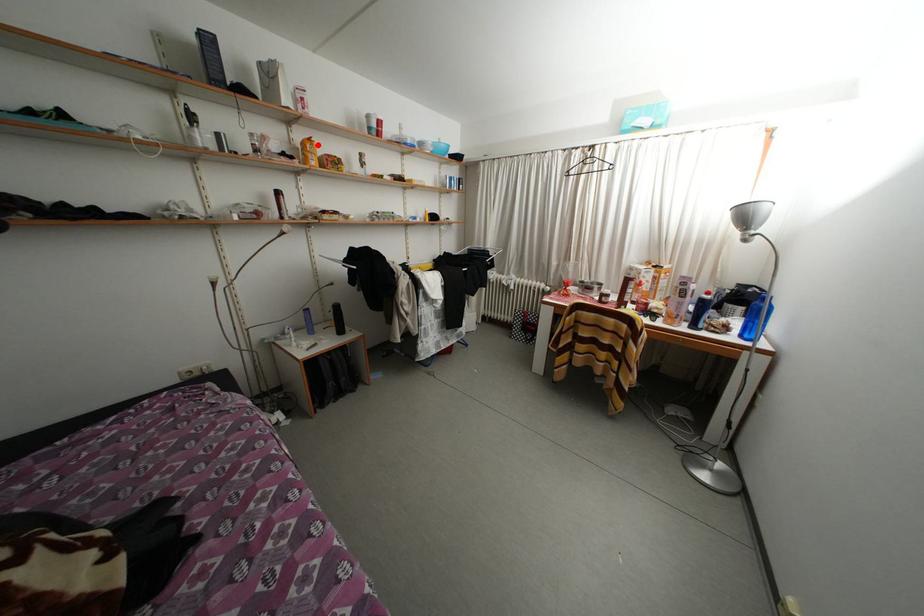
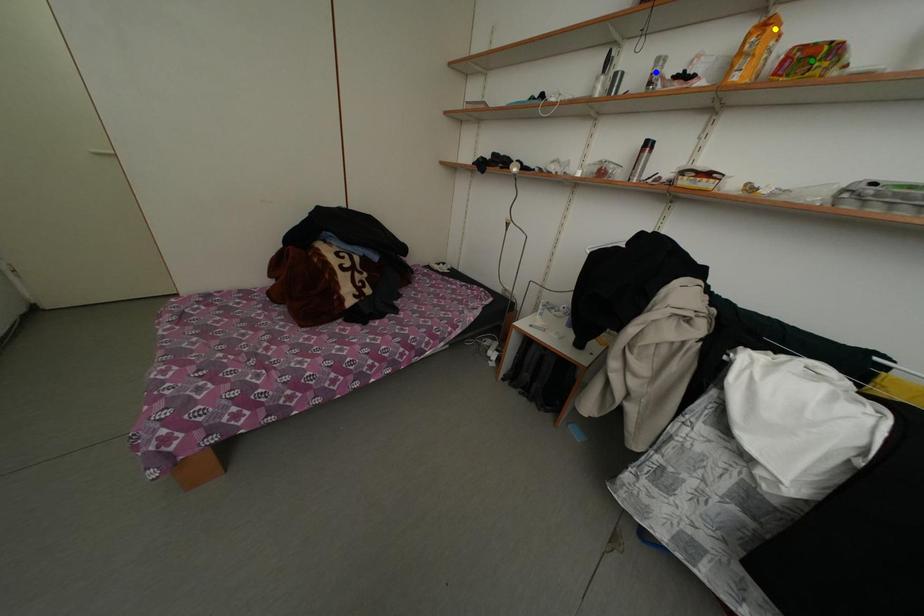
Question: I am providing you with two images of the same scene from different viewpoints. A red point is marked on the first image. You are given multiple points on the second image. Can you choose the point in image 2 that corresponds to the point in image 1?

Choices:
 (A) blue point
 (B) yellow point
 (C) green point

Answer: (B)